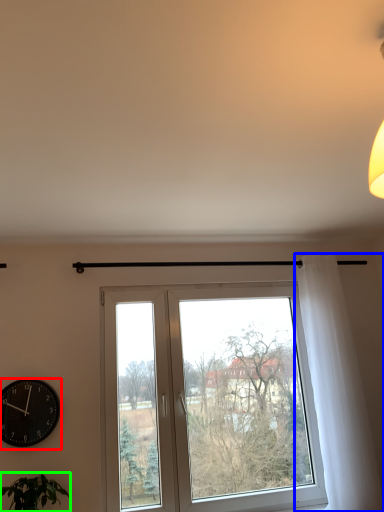
Question: Which object is positioned closest to wall clock (highlighted by a red box)? Select from curtain (highlighted by a blue box) and houseplant (highlighted by a green box).

Choices:
 (A) curtain
 (B) houseplant

Answer: (B)